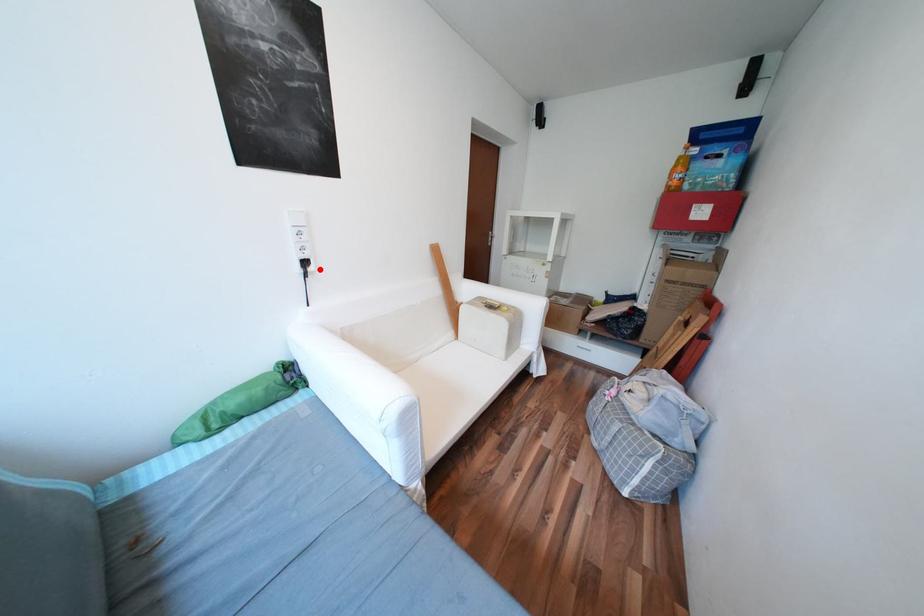
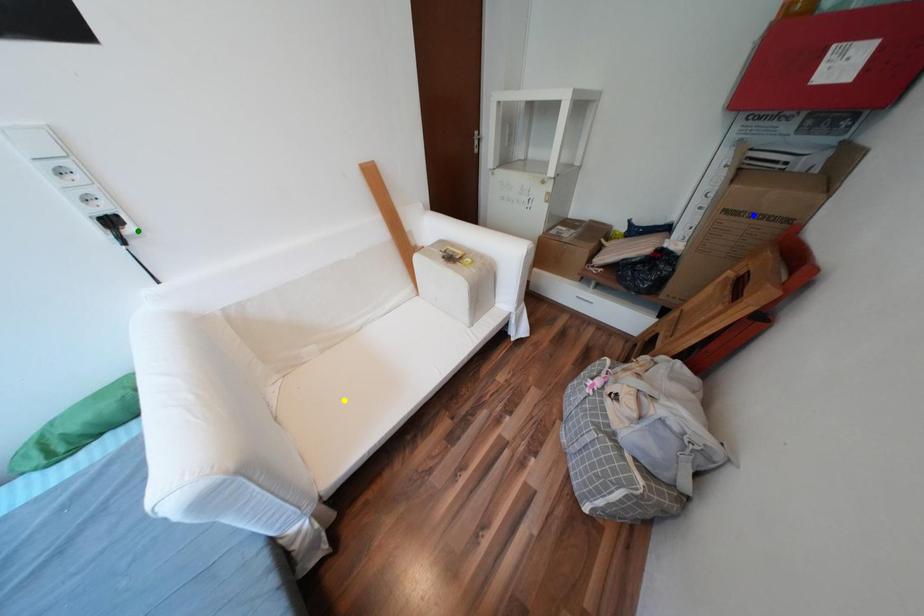
Question: I am providing you with two images of the same scene from different viewpoints. A red point is marked on the first image. You are given multiple points on the second image. Can you choose the point in image 2 that corresponds to the point in image 1?

Choices:
 (A) blue point
 (B) yellow point
 (C) green point

Answer: (C)